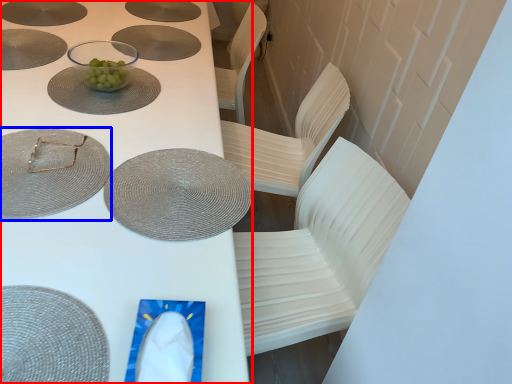
Question: Which of the following is the farthest to the observer, table (highlighted by a red box) or glass plate (highlighted by a blue box)?

Choices:
 (A) table
 (B) glass plate

Answer: (B)